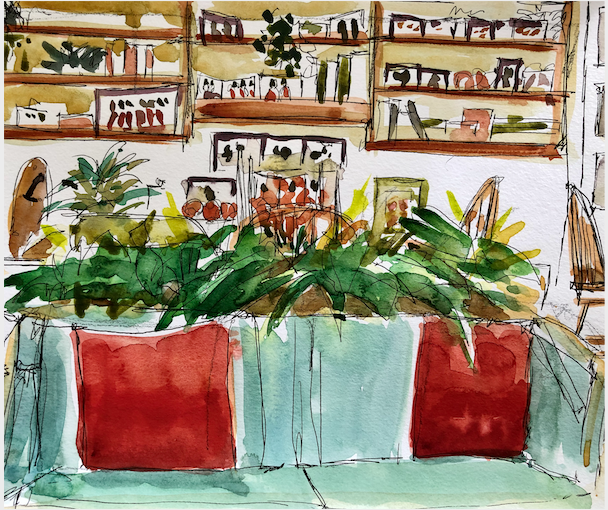
I want to click on 1 left pillow, so click(157, 406).